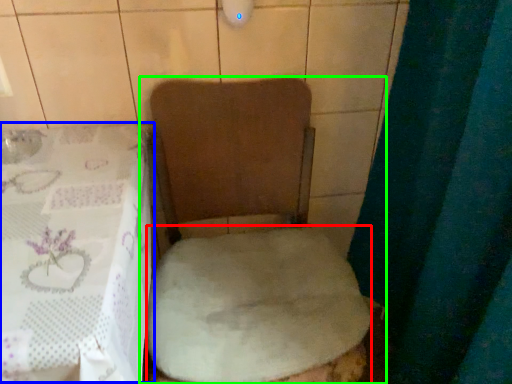
Question: Which object is positioned closest to sheet (highlighted by a red box)? Select from table (highlighted by a blue box) and toilet (highlighted by a green box).

Choices:
 (A) table
 (B) toilet

Answer: (B)